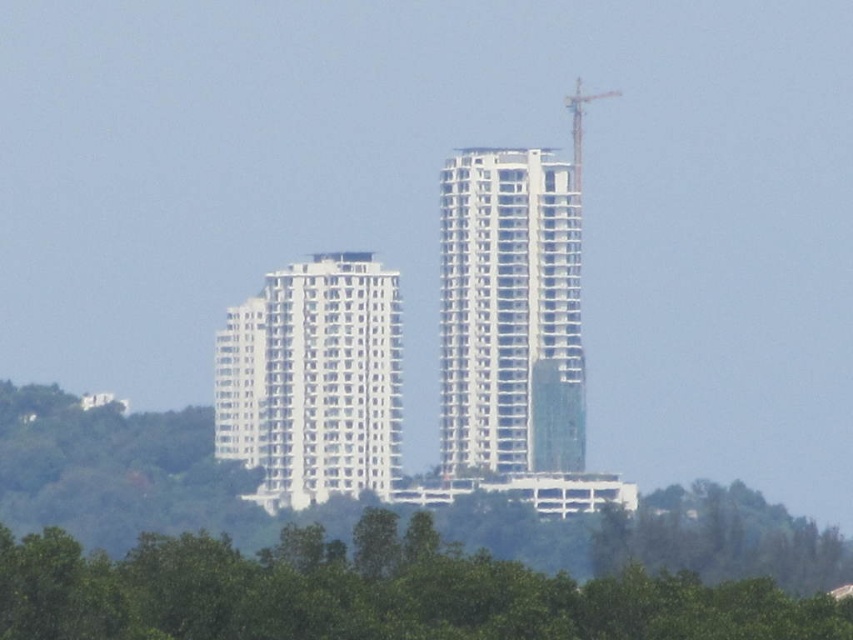
In the scene shown: You are a construction worker standing at the base of the white smooth building at center. You need to move to the metallic gray crane at upper right. Is the crane above or below your current position?

The metallic gray crane at upper right is above your current position because the white smooth building at center is closer to the viewer than the metallic gray crane at upper right, implying the crane is positioned higher up in the scene.

You are a construction inspector who needs to assess the height of the white concrete building at center and the metallic gray crane at upper right. Based on the scene, which object is taller?

The white concrete building at center is much taller than the metallic gray crane at upper right according to the description.